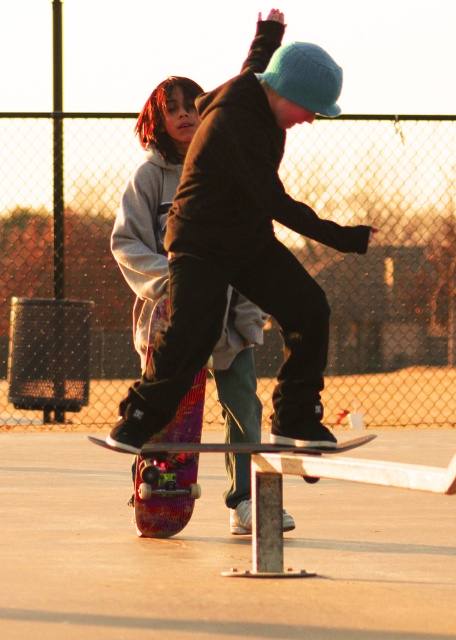
Question: Does multicolored wooden skateboard at center appear over multicolored glossy skateboard at center?

Choices:
 (A) no
 (B) yes

Answer: (B)

Question: Can you confirm if multicolored wooden skateboard at center is positioned to the right of multicolored glossy skateboard at center?

Choices:
 (A) no
 (B) yes

Answer: (B)

Question: Is multicolored wooden skateboard at center bigger than multicolored glossy skateboard at center?

Choices:
 (A) yes
 (B) no

Answer: (A)

Question: Which point is closer to the camera?

Choices:
 (A) (289, 445)
 (B) (259, 88)

Answer: (B)

Question: Which object is closer to the camera taking this photo?

Choices:
 (A) multicolored glossy skateboard at center
 (B) multicolored wooden skateboard at center

Answer: (A)

Question: Among these points, which one is farthest from the camera?

Choices:
 (A) (281, 410)
 (B) (160, 477)

Answer: (B)